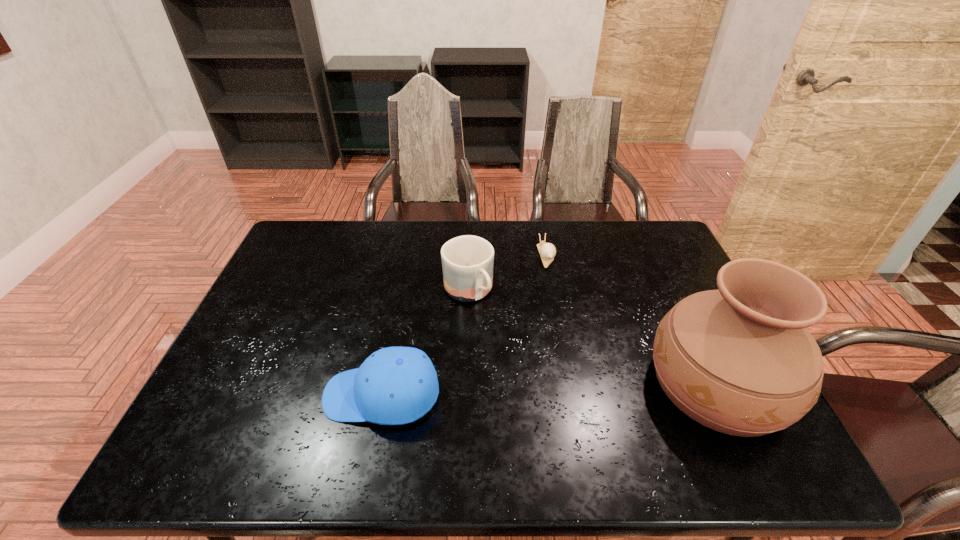
The width and height of the screenshot is (960, 540). Find the location of `vacant space situated 0.280m on the side with the handle of the third nearest object`. vacant space situated 0.280m on the side with the handle of the third nearest object is located at coordinates (536, 382).

Image resolution: width=960 pixels, height=540 pixels. What are the coordinates of `vacant space located on the side with the handle of the third nearest object` in the screenshot? It's located at click(x=500, y=336).

The height and width of the screenshot is (540, 960). What are the coordinates of `free space located 0.050m on the side with the handle of the third nearest object` in the screenshot? It's located at (489, 322).

Identify the location of free space located on the shell of the shortest object. (568, 320).

Locate an element on the screen. blank area located on the shell of the shortest object is located at coordinates (578, 347).

At what (x,y) coordinates should I click in order to perform the action: click on vacant space located 0.400m on the shell of the shortest object. Please return your answer as a coordinate pair (x, y). The width and height of the screenshot is (960, 540). Looking at the image, I should click on (587, 368).

The image size is (960, 540). I want to click on object positioned at the far edge, so click(547, 251).

Identify the location of cap that is positioned at the near edge. The image size is (960, 540). (395, 385).

At what (x,y) coordinates should I click in order to perform the action: click on urn that is at the near edge. Please return your answer as a coordinate pair (x, y). This screenshot has width=960, height=540. Looking at the image, I should click on (739, 360).

Locate an element on the screen. object at the right edge is located at coordinates (739, 360).